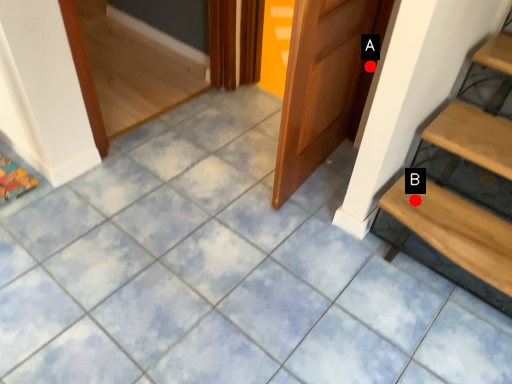
Question: Two points are circled on the image, labeled by A and B beside each circle. Which point is farther from the camera taking this photo?

Choices:
 (A) A is further
 (B) B is further

Answer: (A)